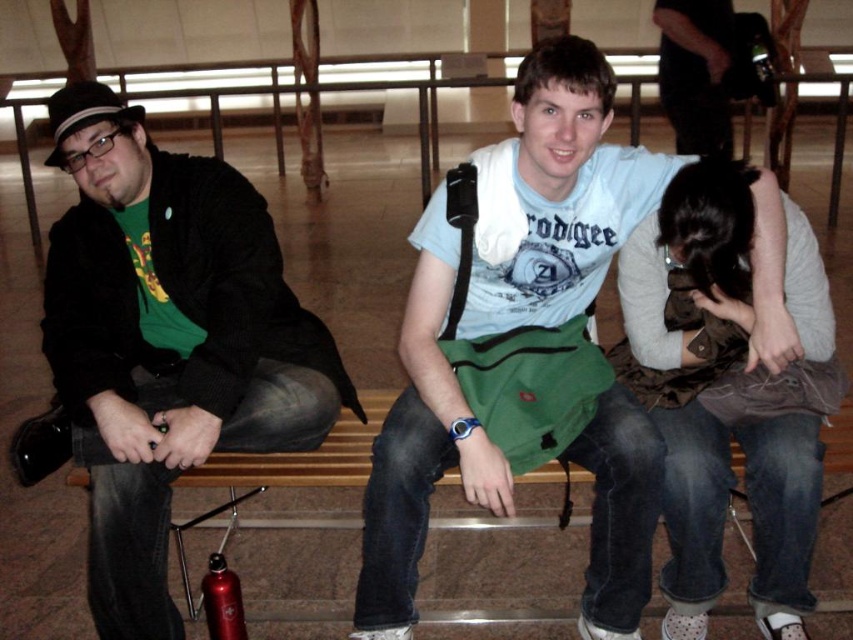
Is matte black jacket at left smaller than brown leather jacket at center?

No.

Is matte black jacket at left bigger than brown leather jacket at center?

Correct, matte black jacket at left is larger in size than brown leather jacket at center.

The height and width of the screenshot is (640, 853). What do you see at coordinates (163, 344) in the screenshot?
I see `matte black jacket at left` at bounding box center [163, 344].

Locate an element on the screen. matte black jacket at left is located at coordinates (163, 344).

Which of these two, brown leather jacket at center or metallic red water bottle at lower left, stands taller?

brown leather jacket at center

Measure the distance between brown leather jacket at center and camera.

The distance of brown leather jacket at center from camera is 5.51 feet.

Image resolution: width=853 pixels, height=640 pixels. What are the coordinates of `brown leather jacket at center` in the screenshot? It's located at (714, 404).

In the scene shown: Who is shorter, matte black jacket at left or metallic red water bottle at lower left?

metallic red water bottle at lower left is shorter.

I want to click on matte black jacket at left, so click(x=163, y=344).

The width and height of the screenshot is (853, 640). In order to click on matte black jacket at left in this screenshot , I will do `click(163, 344)`.